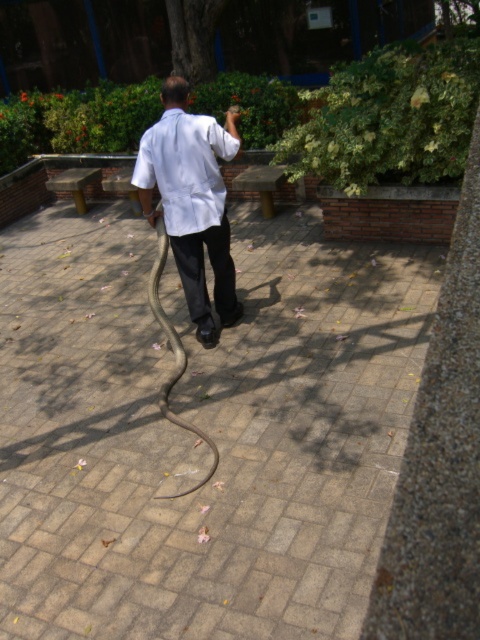
You are standing at the point marked as point [203,429] in the image. What type of surface are you currently standing on?

The point [203,429] is on brick paved ground at center.

You are a photographer standing behind the man and the snake. You want to take a photo that includes both the brick paved ground at center and the white matte dress shirt at center. Which object should be placed closer to the camera to ensure both are in focus?

The brick paved ground at center is taller than the white matte dress shirt at center. To ensure both are in focus, the taller object, brick paved ground at center, should be placed closer to the camera.